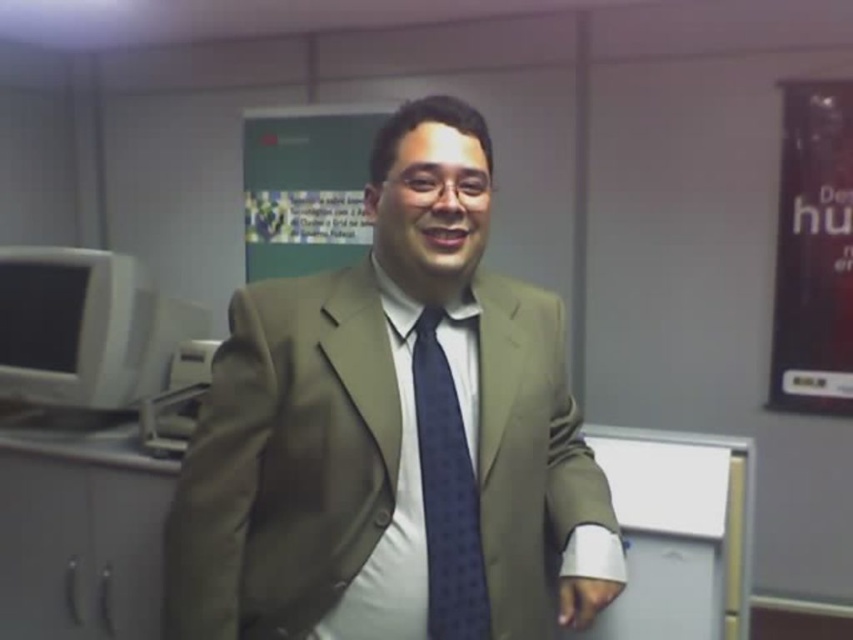
You are a fashion designer observing a man wearing a matte brown suit at center and a blue dotted fabric tie at center. Which clothing item would you need to adjust if you want to create a more balanced appearance between the two?

The matte brown suit at center is larger in size than the blue dotted fabric tie at center. To create a more balanced appearance, you could adjust the size of the blue dotted fabric tie at center to make it proportionally larger relative to the matte brown suit at center.

You are taking a photo of the man in the office. You want to focus on the point closer to the camera. Which point should you choose between point (541, 348) and point (486, 589)?

Point (541, 348) is further to the camera than point (486, 589), so you should choose point (541, 348) as the focus point.